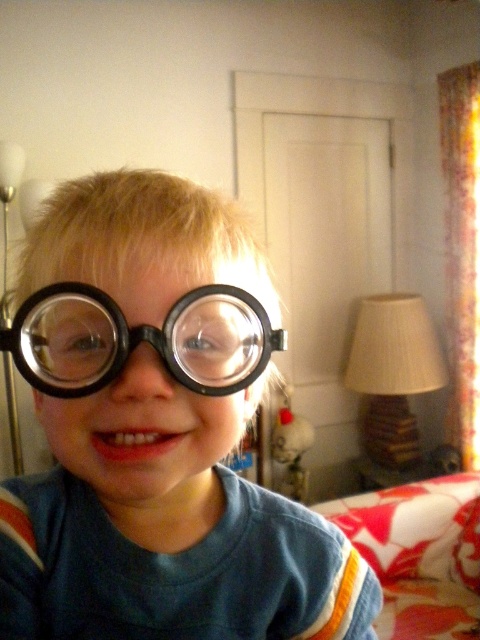
Question: Can you confirm if matte black glasses at center is wider than black matte goggles at center?

Choices:
 (A) yes
 (B) no

Answer: (A)

Question: Which of the following is the farthest from the observer?

Choices:
 (A) matte black glasses at center
 (B) black matte goggles at center

Answer: (A)

Question: Which of the following is the closest to the observer?

Choices:
 (A) (190, 365)
 (B) (182, 428)

Answer: (A)

Question: Is matte black glasses at center further to camera compared to black matte goggles at center?

Choices:
 (A) yes
 (B) no

Answer: (A)

Question: Considering the relative positions of matte black glasses at center and black matte goggles at center in the image provided, where is matte black glasses at center located with respect to black matte goggles at center?

Choices:
 (A) right
 (B) left

Answer: (A)

Question: Which point is closer to the camera?

Choices:
 (A) black matte goggles at center
 (B) matte black glasses at center

Answer: (A)